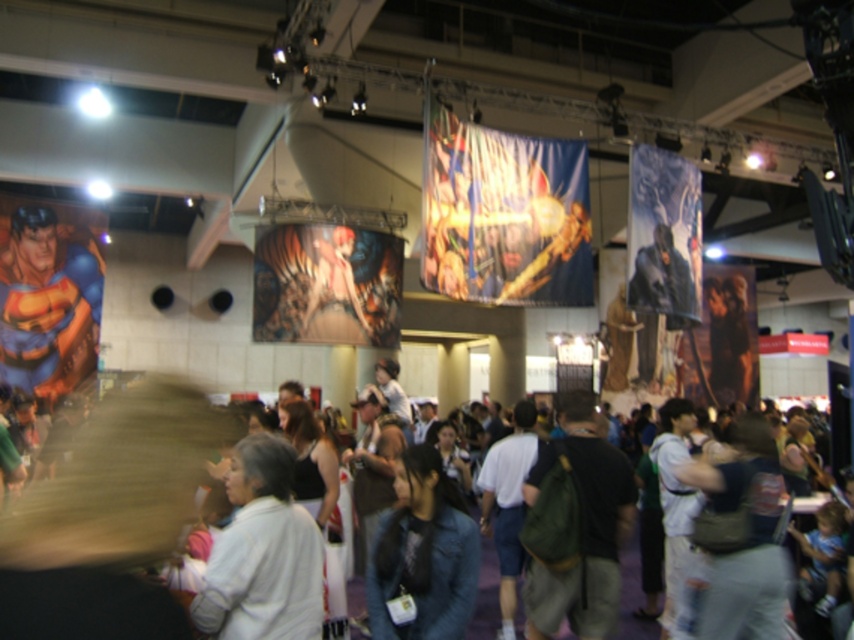
You are standing in the convention hall and notice two points marked on the wall banners. The first point is at coordinate point (313, 531) and the second at point (405, 538). Which point is nearer to you?

Point (313, 531) is closer to the viewer than point (405, 538).

You are at a convention and see a white fabric at center and a denim jacket at center. Which one is higher?

The white fabric at center is above the denim jacket at center, so it is higher.